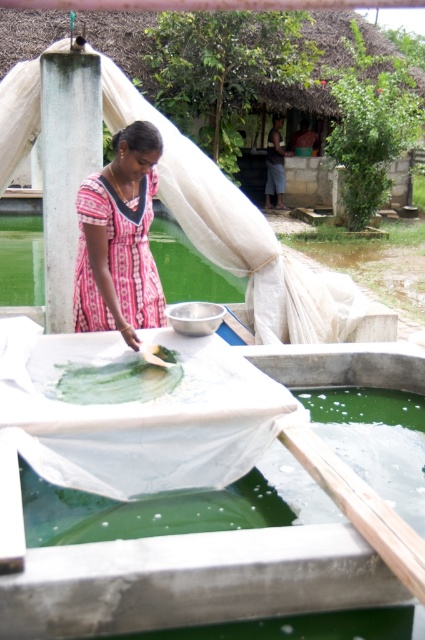
Question: Does green translucent pool at lower center have a smaller size compared to pink printed dress at center?

Choices:
 (A) no
 (B) yes

Answer: (A)

Question: Which of these objects is positioned closest to the green translucent pool at lower center?

Choices:
 (A) pink printed dress at center
 (B) green matte paint at center

Answer: (B)

Question: Which object is closer to the camera taking this photo?

Choices:
 (A) pink printed dress at center
 (B) green matte pond at center

Answer: (A)

Question: Does pink printed dress at center appear under green matte paint at center?

Choices:
 (A) yes
 (B) no

Answer: (B)

Question: Does green translucent pool at lower center have a lesser width compared to pink printed dress at center?

Choices:
 (A) no
 (B) yes

Answer: (A)

Question: Which object appears closest to the camera in this image?

Choices:
 (A) green matte pond at center
 (B) green translucent pool at lower center
 (C) pink printed dress at center

Answer: (B)